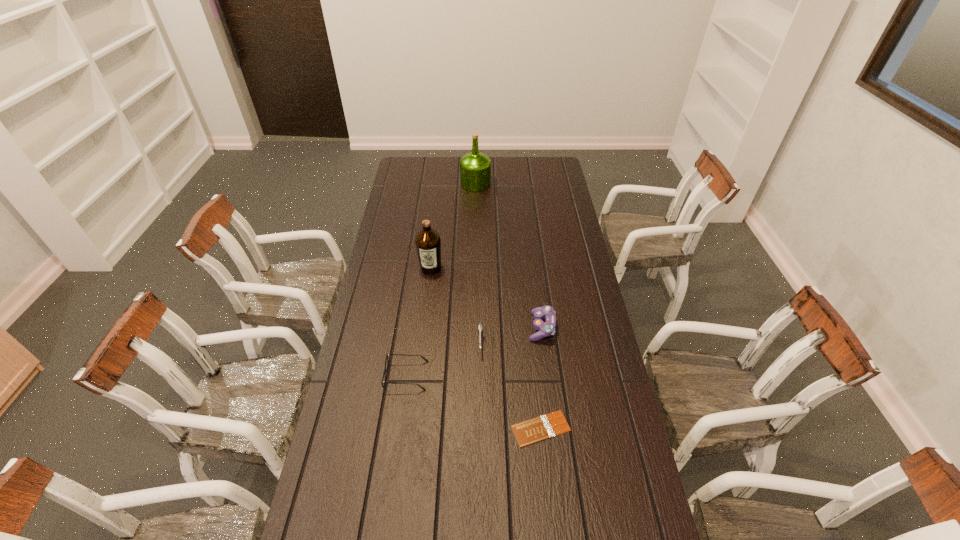
Where is `free region at the right edge of the desktop`? This screenshot has width=960, height=540. free region at the right edge of the desktop is located at coordinates (566, 346).

You are a GUI agent. You are given a task and a screenshot of the screen. Output one action in this format:
    pyautogui.click(x=<x>, y=<y>)
    Task: Click on the empty space between the nearer olive oil and the control
    Image resolution: width=960 pixels, height=540 pixels.
    Given the screenshot: What is the action you would take?
    pyautogui.click(x=486, y=298)

Where is `empty space that is in between the control and the second shortest object`? Image resolution: width=960 pixels, height=540 pixels. empty space that is in between the control and the second shortest object is located at coordinates (474, 352).

Identify the location of free space between the pistol and the nearest object. (511, 385).

Image resolution: width=960 pixels, height=540 pixels. Identify the location of free spot between the control and the shortest object. (541, 377).

Where is `free spot between the pistol and the shortest object`? free spot between the pistol and the shortest object is located at coordinates (511, 385).

Image resolution: width=960 pixels, height=540 pixels. Identify the location of empty space that is in between the left olive oil and the control. (486, 298).

Where is `free space between the chocolate bar and the fifth farthest object`? Image resolution: width=960 pixels, height=540 pixels. free space between the chocolate bar and the fifth farthest object is located at coordinates (473, 402).

Image resolution: width=960 pixels, height=540 pixels. I want to click on empty space that is in between the fourth tallest object and the farthest object, so click(478, 262).

Where is `free spot between the shorter olive oil and the control`? free spot between the shorter olive oil and the control is located at coordinates (486, 298).